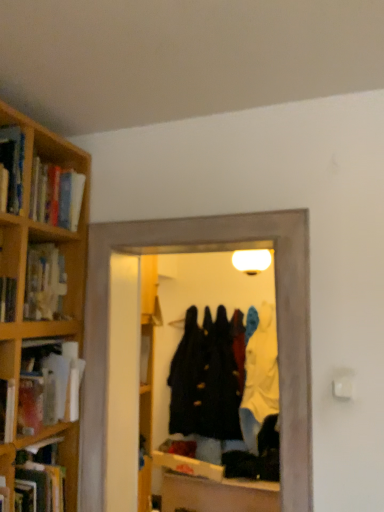
Question: Is velvet black coat at center, which is counted as the 1th clothing, starting from the left, inside or outside of transparent glass door at center?

Choices:
 (A) inside
 (B) outside

Answer: (B)

Question: Based on their positions, is velvet black coat at center, arranged as the 2th clothing when viewed from the right, located to the left or right of transparent glass door at center?

Choices:
 (A) right
 (B) left

Answer: (A)

Question: Estimate the real-world distances between objects in this image. Which object is farther from the transparent glass door at center?

Choices:
 (A) matte cardboard book at left, which appears as the second book when ordered from the bottom
 (B) wooden bookshelf at left
 (C) velvet black coat at center, arranged as the 2th clothing when viewed from the right
 (D) yellow fabric coat at center, which is counted as the first clothing, starting from the right
 (E) hardcover book at left, which is counted as the first book, starting from the bottom

Answer: (C)

Question: Which is nearer to the velvet black coat at center, arranged as the 2th clothing when viewed from the right?

Choices:
 (A) matte cardboard book at left, which is counted as the 1th book, starting from the top
 (B) transparent glass door at center
 (C) wooden bookshelf at left
 (D) yellow fabric coat at center, which is the 2th clothing in left-to-right order
 (E) hardcover book at left, which is counted as the first book, starting from the bottom

Answer: (D)